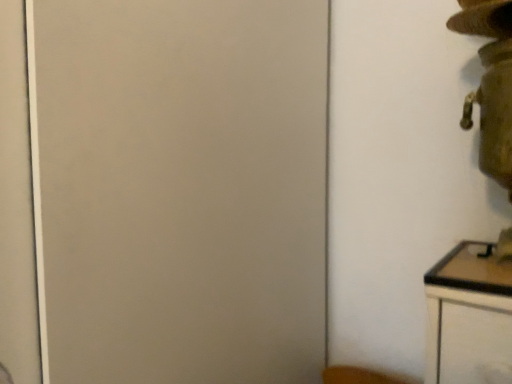
The width and height of the screenshot is (512, 384). Describe the element at coordinates (490, 84) in the screenshot. I see `matte brown table lamp at right` at that location.

This screenshot has width=512, height=384. Identify the location of matte brown table lamp at right. (490, 84).

Measure the distance between point (507, 72) and camera.

Point (507, 72) and camera are 68.00 centimeters apart.

The width and height of the screenshot is (512, 384). In order to click on matte brown table lamp at right in this screenshot , I will do `click(490, 84)`.